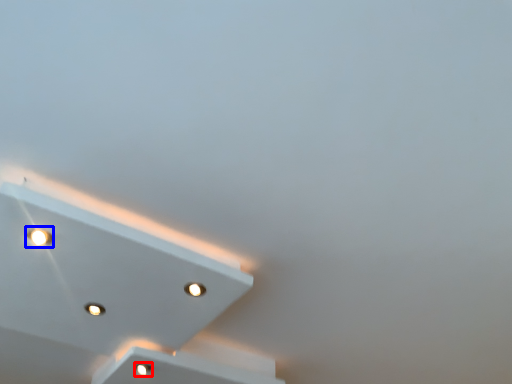
Question: Among these objects, which one is nearest to the camera, dot (highlighted by a red box) or dot (highlighted by a blue box)?

Choices:
 (A) dot
 (B) dot

Answer: (B)